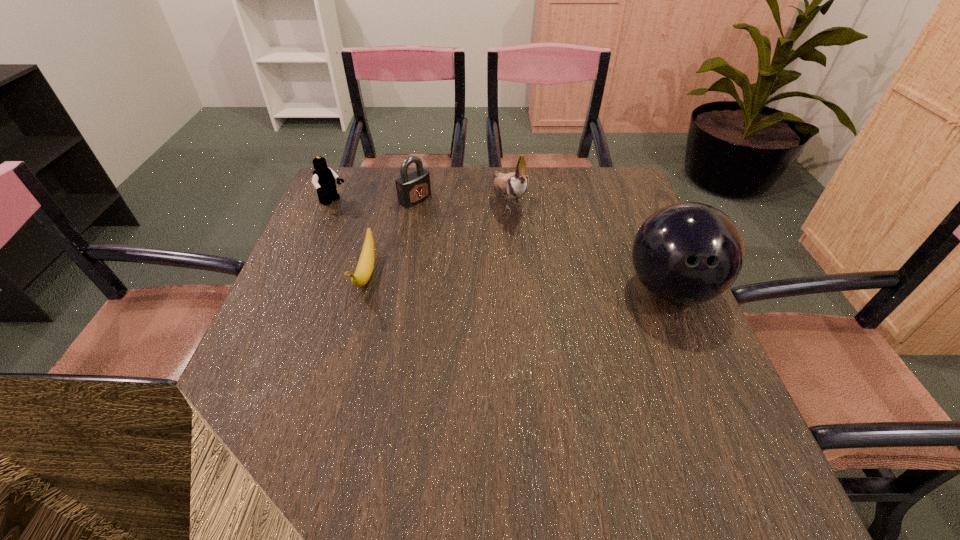
Identify the location of vacant space that is in between the bird and the shortest object. click(438, 237).

Locate an element on the screen. vacant region between the Lego and the shortest object is located at coordinates (349, 239).

Image resolution: width=960 pixels, height=540 pixels. I want to click on free point between the leftmost object and the rightmost object, so click(x=502, y=246).

Identify the location of free space between the shortest object and the leftmost object. (349, 239).

This screenshot has height=540, width=960. What are the coordinates of `empty location between the rightmost object and the fourth object from left to right` in the screenshot? It's located at (589, 244).

Find the location of a particular element. The width and height of the screenshot is (960, 540). free area in between the padlock and the leftmost object is located at coordinates (374, 201).

What are the coordinates of `vacant area between the shortest object and the bowling ball` in the screenshot? It's located at (518, 282).

Locate an element on the screen. empty location between the second object from right to left and the fourth object from right to left is located at coordinates (438, 237).

Locate which object is the third closest to the shortest object. Please provide its 2D coordinates. Your answer should be formatted as a tuple, i.e. [(x, y)], where the tuple contains the x and y coordinates of a point satisfying the conditions above.

[(513, 185)]

You are a GUI agent. You are given a task and a screenshot of the screen. Output one action in this format:
    pyautogui.click(x=<x>, y=<y>)
    Task: Click on the object that is the fourth closest to the bird
    The width and height of the screenshot is (960, 540).
    Given the screenshot: What is the action you would take?
    tap(324, 178)